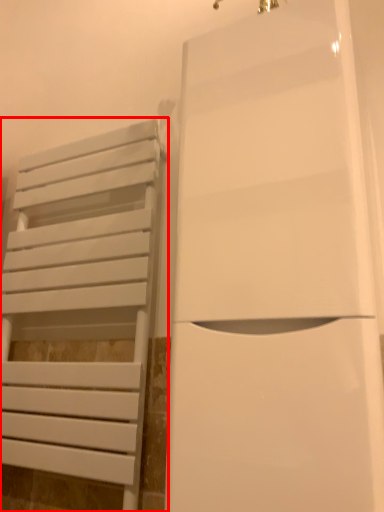
Question: From the image's perspective, what is the correct spatial relationship of furniture (annotated by the red box) in relation to door?

Choices:
 (A) above
 (B) below

Answer: (B)